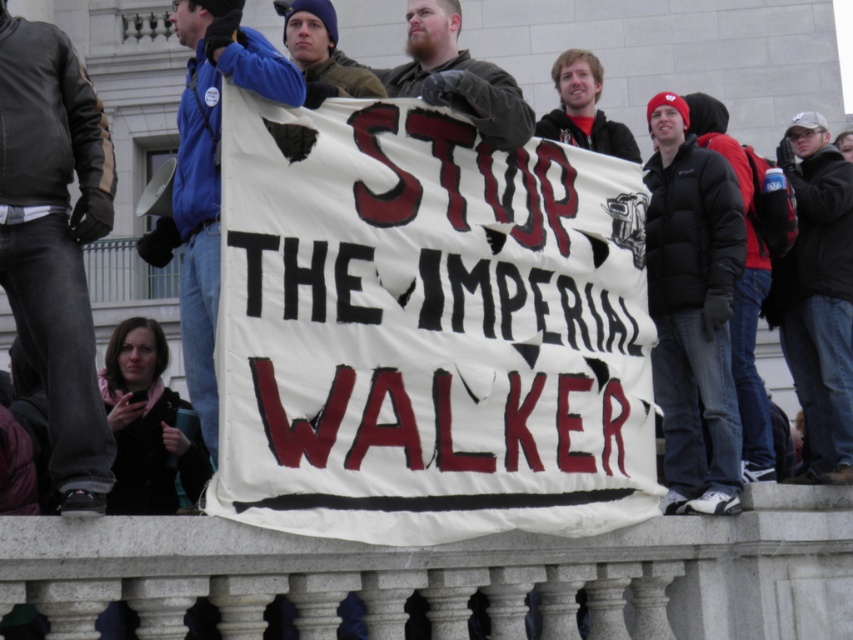
Does black jacket at center have a lesser width compared to brown woolen hat at upper center?

Correct, black jacket at center's width is less than brown woolen hat at upper center's.

Between point (792, 305) and point (293, 32), which one is positioned in front?

Point (293, 32) is more forward.

The height and width of the screenshot is (640, 853). What are the coordinates of `black jacket at center` in the screenshot? It's located at (817, 296).

Who is positioned more to the right, dark brown leather jacket at lower left or black jacket at center?

black jacket at center

Between point (16, 298) and point (795, 372), which one is positioned behind?

The point (795, 372) is behind.

Who is more distant from viewer, (57, 456) or (790, 128)?

The point (790, 128) is more distant.

Identify the location of dark brown leather jacket at lower left. The width and height of the screenshot is (853, 640). (55, 241).

Can you confirm if black jacket at center is taller than bearded man at center?

Correct, black jacket at center is much taller as bearded man at center.

Is black jacket at center wider than bearded man at center?

No.

Is point (810, 154) positioned after point (447, 68)?

Yes, point (810, 154) is farther from viewer.

Locate an element on the screen. black jacket at center is located at coordinates (817, 296).